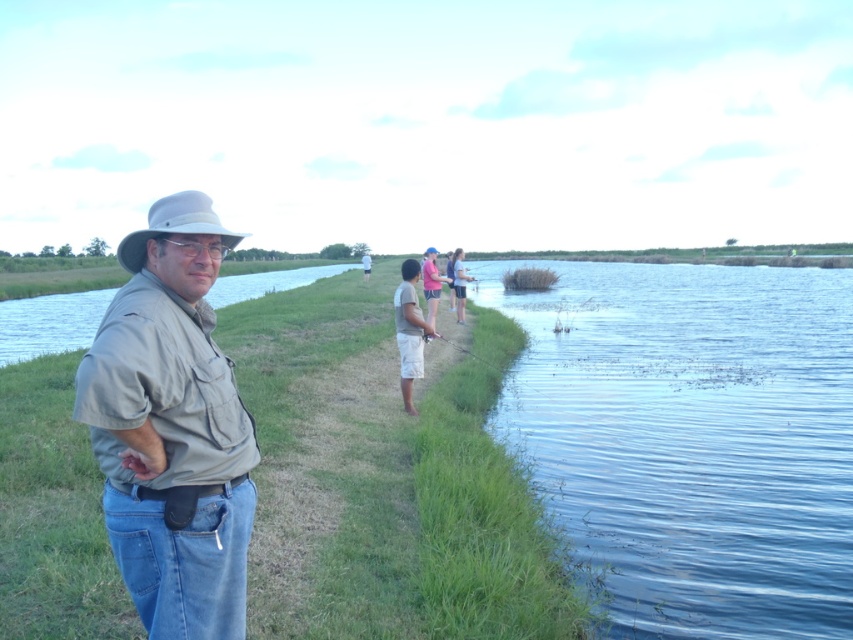
You are a fashion designer analyzing the outfit of a man in the image. The man is wearing a tan cotton shorts at center and a pink fabric shirt at center. Which piece of clothing is positioned lower on his body?

The tan cotton shorts at center is positioned lower on his body than the pink fabric shirt at center.

You are a tailor measuring the distance between the tan cotton shorts at center and the pink fabric shirt at center for a custom fitting. The minimum required space between these items is 36 inches to ensure proper movement. Based on the image, is the current distance sufficient?

The distance between the tan cotton shorts at center and the pink fabric shirt at center is 35.49 inches, which is slightly less than the required 36 inches. Therefore, the current distance is insufficient for proper movement.

You are a fashion designer analyzing the outfit of a man in the scene. Based on the positioning of the light blue denim jeans at center and the blue fabric hat at center, which item is located higher on his body?

The light blue denim jeans at center is above the blue fabric hat at center, so the jeans are positioned higher on his body than the hat.